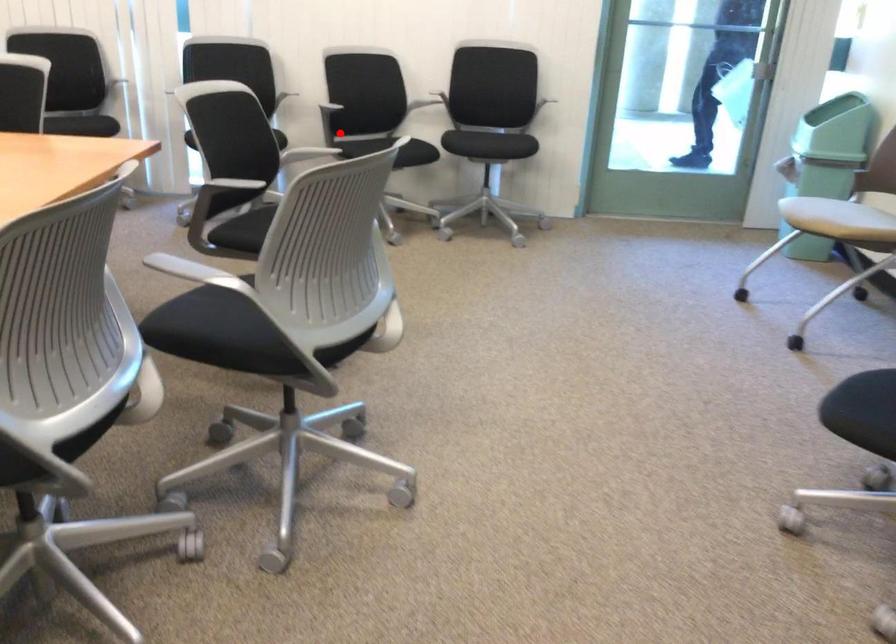
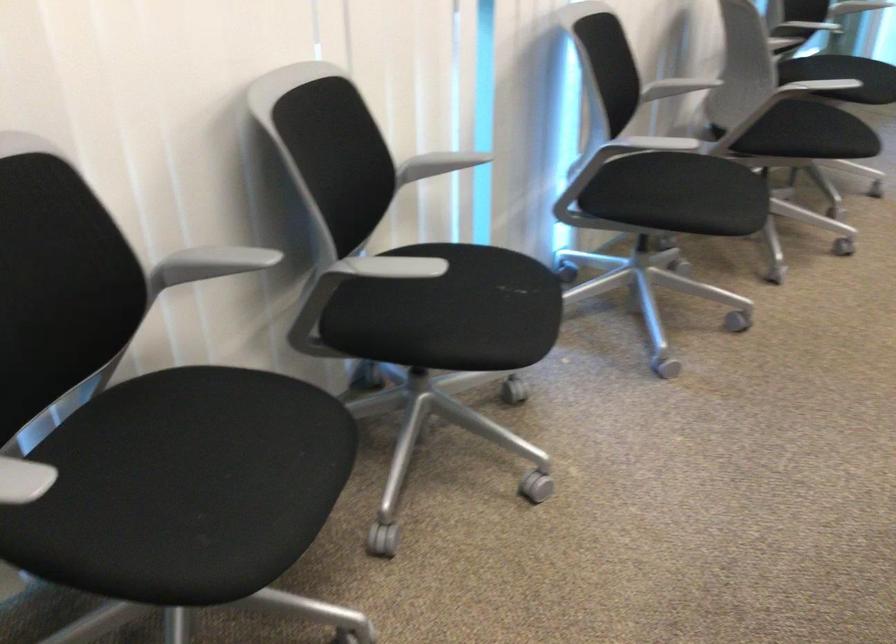
Find the pixel in the second image that matches the highlighted location in the first image.

(810, 134)